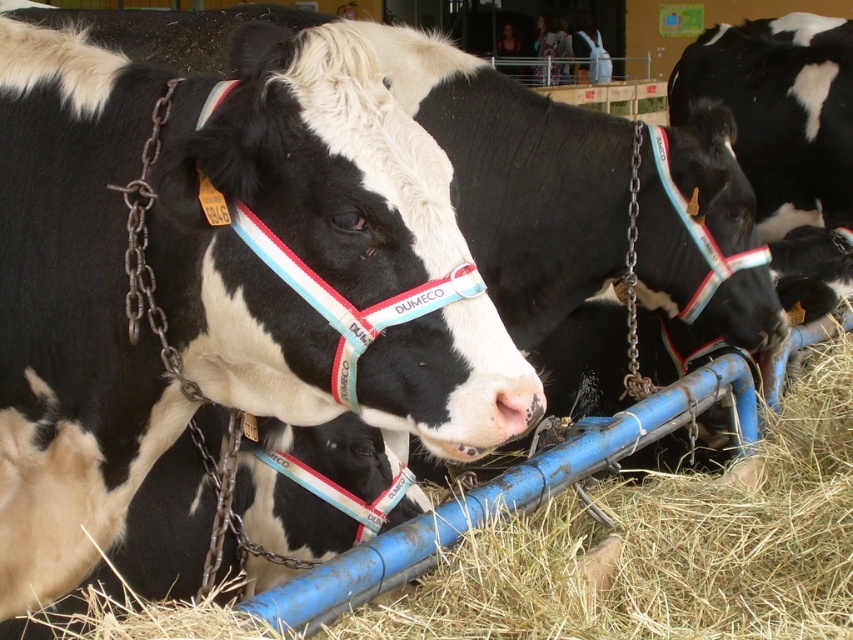
Consider the image. You are standing in the barn and see two metallic chains, the metallic chain at left and the metallic chain at center. Which one is nearer to you?

The metallic chain at left is closer to the viewer than the metallic chain at center, so the metallic chain at left is nearer to you.

You are standing in front of the blue metal trough with Holstein cows. There are two points marked in the scene. The first point is at coordinate (248, 426) and the second is at (627, 324). Which point is closer to you?

Point (248, 426) is closer to the viewer than point (627, 324).